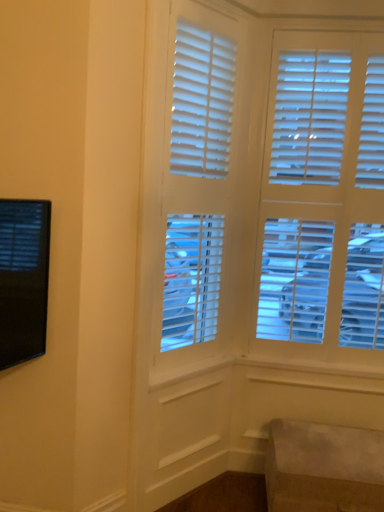
Question: From the image's perspective, relative to suede-like beige ottoman at lower right, is white matte blinds at center above or below?

Choices:
 (A) above
 (B) below

Answer: (A)

Question: Considering their positions, is white matte blinds at center located in front of or behind suede-like beige ottoman at lower right?

Choices:
 (A) front
 (B) behind

Answer: (A)

Question: From their relative heights in the image, would you say white matte blinds at center is taller or shorter than suede-like beige ottoman at lower right?

Choices:
 (A) tall
 (B) short

Answer: (A)

Question: Would you say suede-like beige ottoman at lower right is to the left or to the right of white matte blinds at center in the picture?

Choices:
 (A) left
 (B) right

Answer: (B)

Question: In terms of width, does suede-like beige ottoman at lower right look wider or thinner when compared to white matte blinds at center?

Choices:
 (A) wide
 (B) thin

Answer: (A)

Question: In terms of height, does suede-like beige ottoman at lower right look taller or shorter compared to white matte blinds at center?

Choices:
 (A) tall
 (B) short

Answer: (B)

Question: Is point (337, 489) positioned closer to the camera than point (190, 287)?

Choices:
 (A) farther
 (B) closer

Answer: (B)